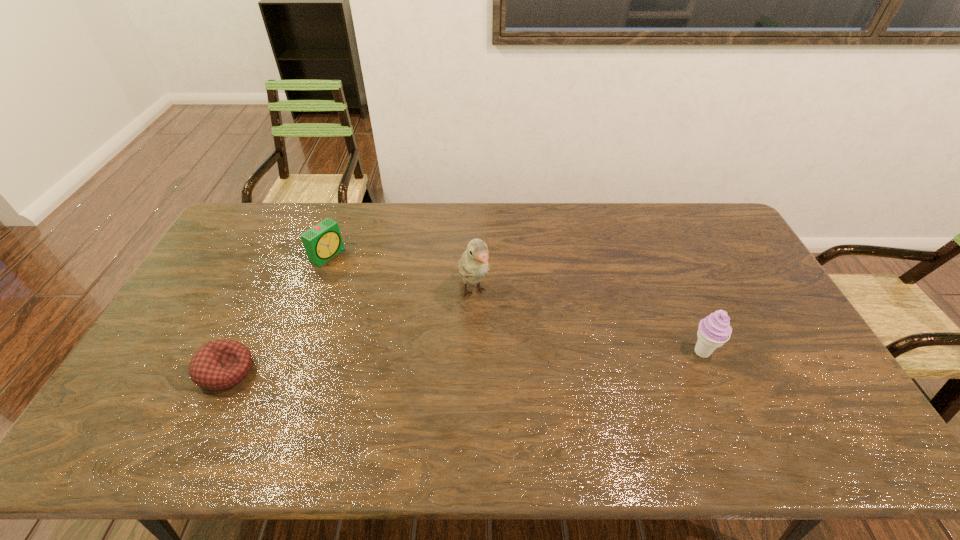
This screenshot has height=540, width=960. I want to click on free spot located 0.280m at the face of the bird, so click(x=516, y=392).

I want to click on vacant space located at the face of the bird, so click(510, 380).

Where is `vacant position located at the face of the bird`? vacant position located at the face of the bird is located at coordinates pos(499,356).

You are a GUI agent. You are given a task and a screenshot of the screen. Output one action in this format:
    pyautogui.click(x=<x>, y=<y>)
    Task: Click on the vacant point located on the front-facing side of the second shortest object
    The width and height of the screenshot is (960, 540).
    Given the screenshot: What is the action you would take?
    [409, 303]

Image resolution: width=960 pixels, height=540 pixels. What are the coordinates of `vacant space located 0.290m on the front-facing side of the second shortest object` in the screenshot? It's located at point(401,299).

I want to click on vacant region located 0.280m on the front-facing side of the second shortest object, so click(399, 298).

This screenshot has width=960, height=540. I want to click on object that is positioned at the near edge, so [x=220, y=364].

The image size is (960, 540). Identify the location of object present at the left edge. (220, 364).

I want to click on object situated at the near left corner, so click(x=220, y=364).

In the image, there is a desktop. Where is `vacant space at the far edge`? The width and height of the screenshot is (960, 540). vacant space at the far edge is located at coordinates (453, 228).